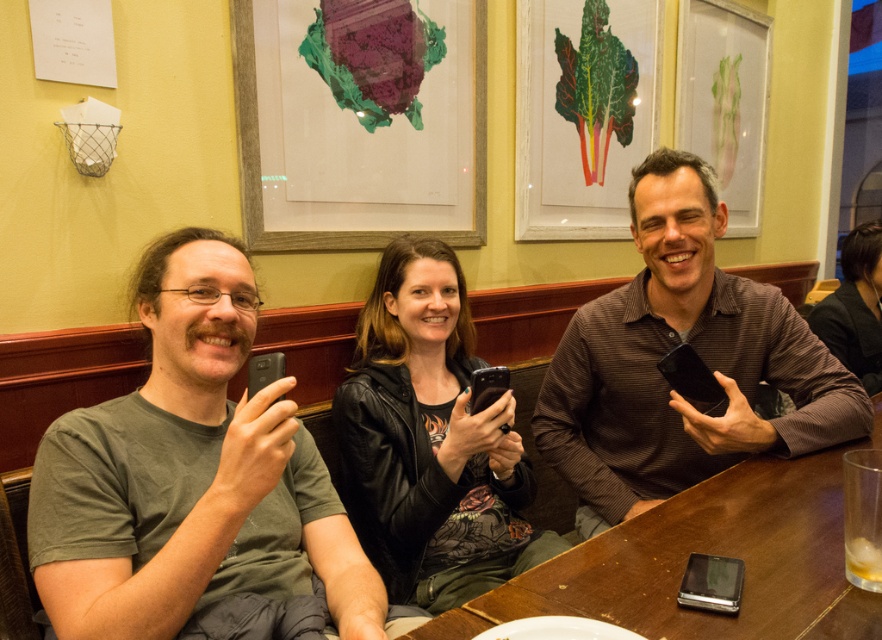
Which is below, green matte shirt at left or black leather jacket at center?

black leather jacket at center

Does point (235, 509) come in front of point (356, 458)?

Yes, point (235, 509) is in front of point (356, 458).

Locate an element on the screen. Image resolution: width=882 pixels, height=640 pixels. green matte shirt at left is located at coordinates (191, 476).

Is brown striped shirt at center below black leather jacket at center?

Incorrect, brown striped shirt at center is not positioned below black leather jacket at center.

Is point (651, 358) farther from viewer compared to point (476, 589)?

That is True.

Find the location of a particular element. Image resolution: width=882 pixels, height=640 pixels. brown striped shirt at center is located at coordinates (673, 348).

Between brown wooden table at center and black leather jacket at upper right, which one is positioned higher?

Positioned higher is black leather jacket at upper right.

Is point (483, 609) in front of point (866, 358)?

That is True.

Find the location of `brown wooden table at center`. brown wooden table at center is located at coordinates point(707,552).

The width and height of the screenshot is (882, 640). In order to click on brown wooden table at center in this screenshot , I will do click(x=707, y=552).